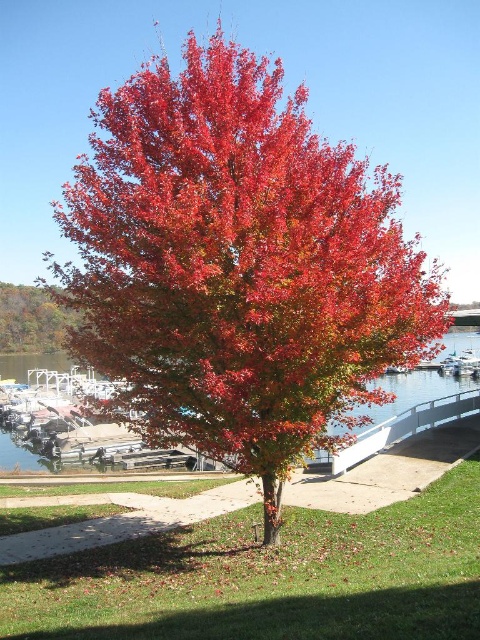
You are an artist setting up an easel to paint the autumn scene. You want to position your easel so that both the shiny red maple tree at center and the shiny brown tree at left are visible in your painting. Based on their positions, which tree should be placed on the left side of your canvas?

The shiny brown tree at left should be placed on the left side of the canvas because the shiny red maple tree at center is to the right of it.

You are standing in the autumn scene and want to take a photo of both the shiny red maple tree at center and the shiny brown tree at left. Which tree should you focus on first to ensure both are in the frame?

You should focus on the shiny red maple tree at center first because it is closer to the viewer than the shiny brown tree at left, so adjusting the camera to include both would require starting with the closer one.